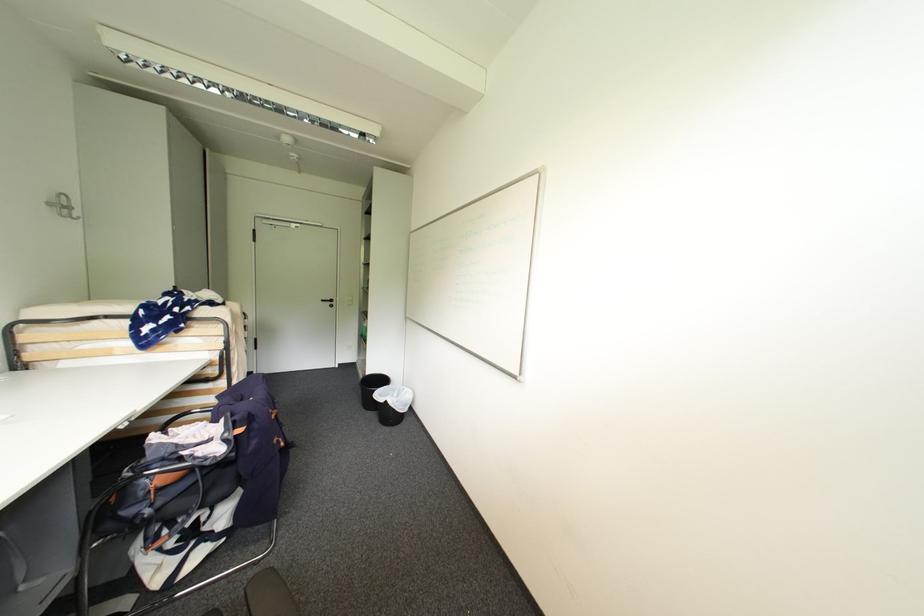
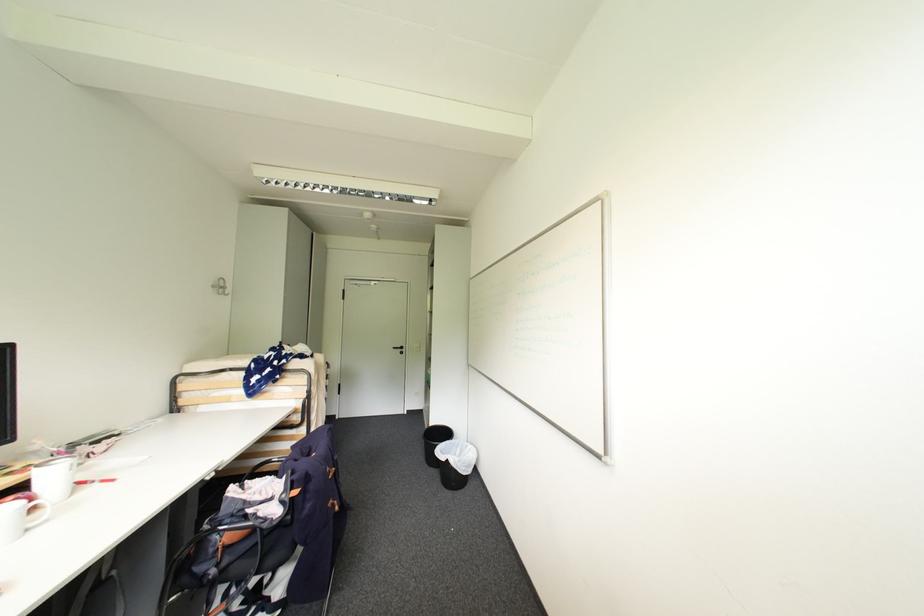
Where in the second image is the point corresponding to the point at 393,387 from the first image?

(456, 442)